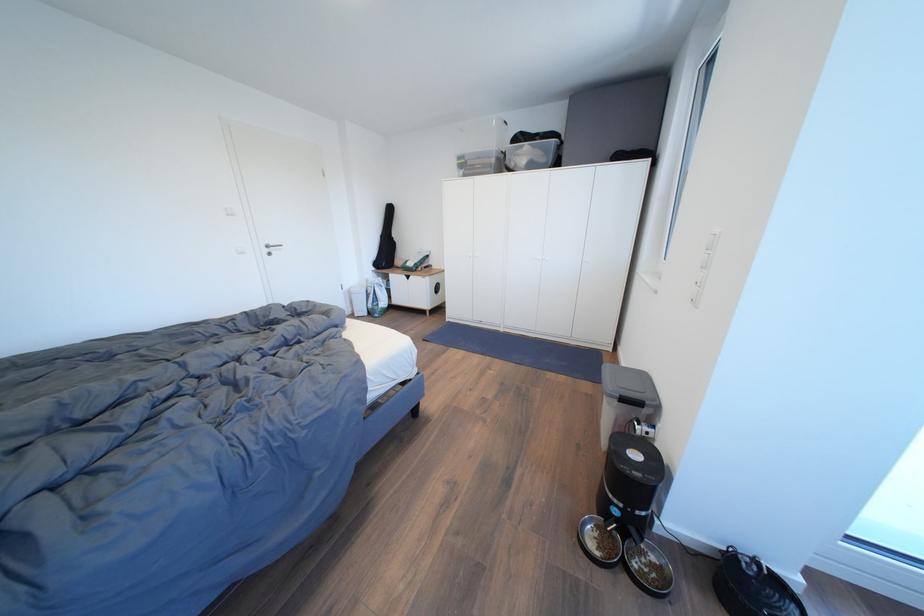
This screenshot has width=924, height=616. I want to click on guitar case handle, so click(x=385, y=241).